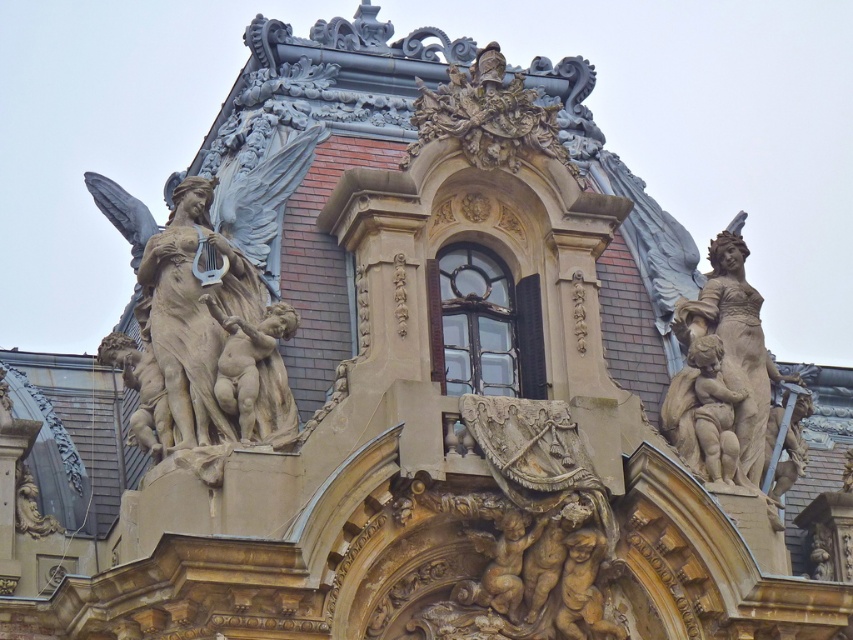
Question: Which point is farther to the camera?

Choices:
 (A) carved stone statue at right
 (B) polished bronze statue at upper left

Answer: (A)

Question: Is polished bronze statue at upper left positioned behind carved stone statue at right?

Choices:
 (A) yes
 (B) no

Answer: (B)

Question: Does polished bronze statue at upper left appear over carved stone statue at right?

Choices:
 (A) yes
 (B) no

Answer: (A)

Question: Which point is farther from the camera taking this photo?

Choices:
 (A) (717, 362)
 (B) (234, 305)

Answer: (A)

Question: Is polished bronze statue at upper left bigger than carved stone statue at right?

Choices:
 (A) yes
 (B) no

Answer: (A)